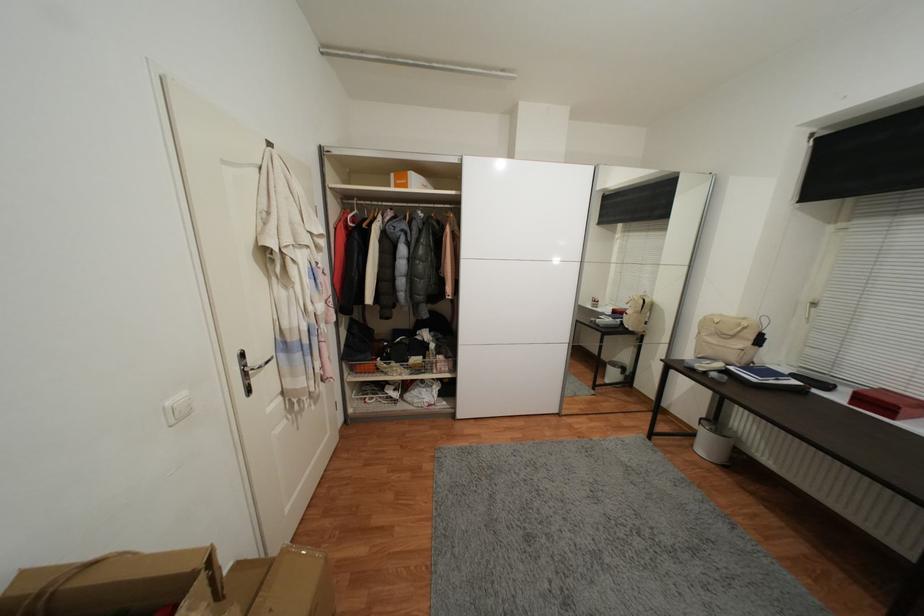
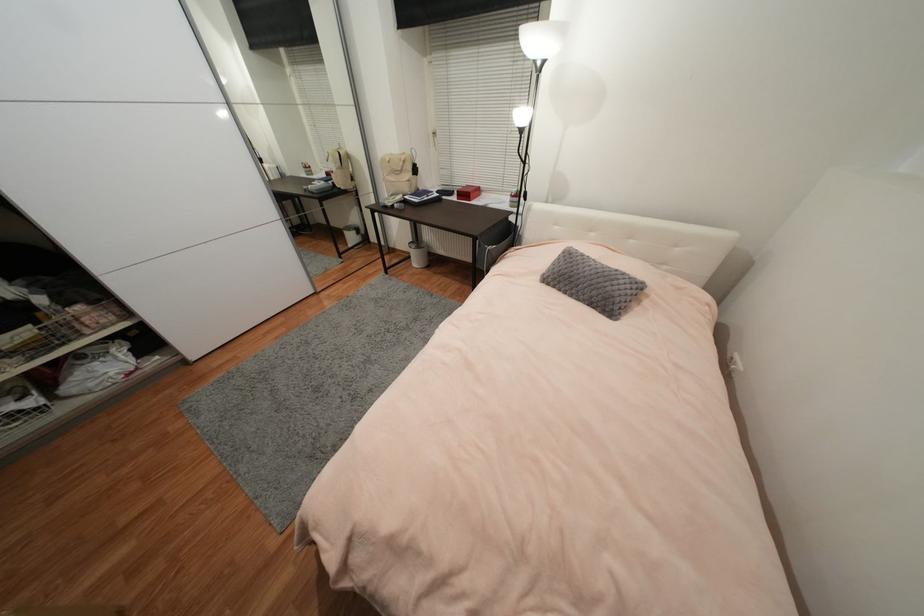
Where in the second image is the point corresponding to the point at 397,389 from the first image?

(14, 400)